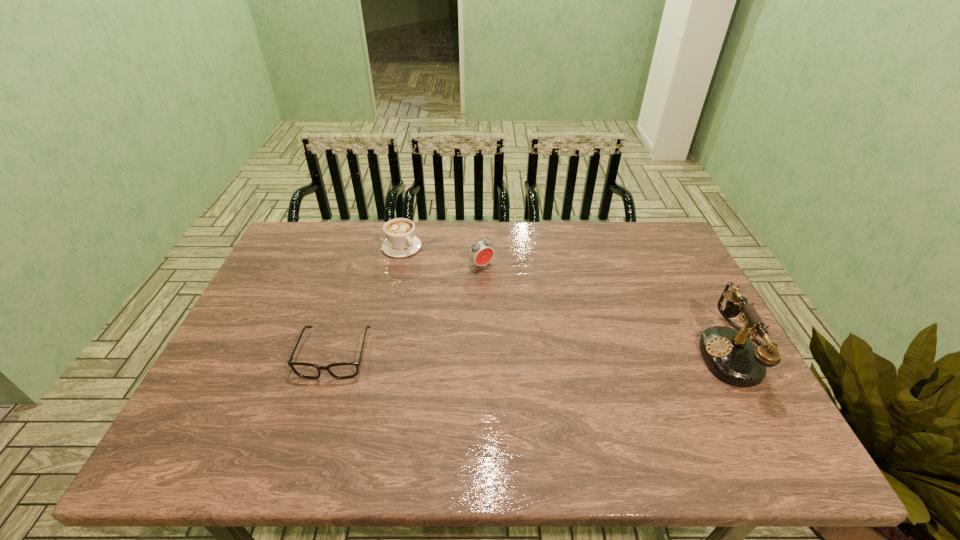
Where is `vacant space that is in between the tallest object and the spectacles`? This screenshot has width=960, height=540. vacant space that is in between the tallest object and the spectacles is located at coordinates (536, 354).

This screenshot has height=540, width=960. In order to click on vacant area that lies between the second tallest object and the second shortest object in this screenshot , I will do `click(442, 256)`.

Where is `free space between the cappuccino and the second tallest object`? This screenshot has width=960, height=540. free space between the cappuccino and the second tallest object is located at coordinates (442, 256).

Where is `vacant region between the second shortest object and the spectacles`? The width and height of the screenshot is (960, 540). vacant region between the second shortest object and the spectacles is located at coordinates (369, 301).

You are a GUI agent. You are given a task and a screenshot of the screen. Output one action in this format:
    pyautogui.click(x=<x>, y=<y>)
    Task: Click on the vacant area between the second shortest object and the second object from right to left
    The width and height of the screenshot is (960, 540).
    Given the screenshot: What is the action you would take?
    pyautogui.click(x=442, y=256)

You are a GUI agent. You are given a task and a screenshot of the screen. Output one action in this format:
    pyautogui.click(x=<x>, y=<y>)
    Task: Click on the vacant area that lies between the farthest object and the alarm clock
    
    Given the screenshot: What is the action you would take?
    pyautogui.click(x=442, y=256)

Locate an element on the screen. Image resolution: width=960 pixels, height=540 pixels. vacant area that lies between the telephone and the alarm clock is located at coordinates (609, 309).

Point out which object is positioned as the second nearest to the telephone. Please provide its 2D coordinates. Your answer should be formatted as a tuple, i.e. [(x, y)], where the tuple contains the x and y coordinates of a point satisfying the conditions above.

[(401, 242)]

This screenshot has width=960, height=540. Find the location of `object that is the closest to the telephone`. object that is the closest to the telephone is located at coordinates (480, 253).

Identify the location of vacant region that satisfies the following two spatial constraints: 1. on the front side of the second farthest object; 2. on the left side of the cappuccino. This screenshot has height=540, width=960. (397, 266).